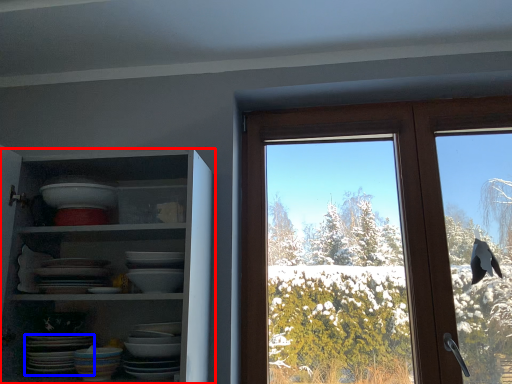
Question: Which point is closer to the camera, shelf (highlighted by a red box) or platter (highlighted by a blue box)?

Choices:
 (A) shelf
 (B) platter

Answer: (A)